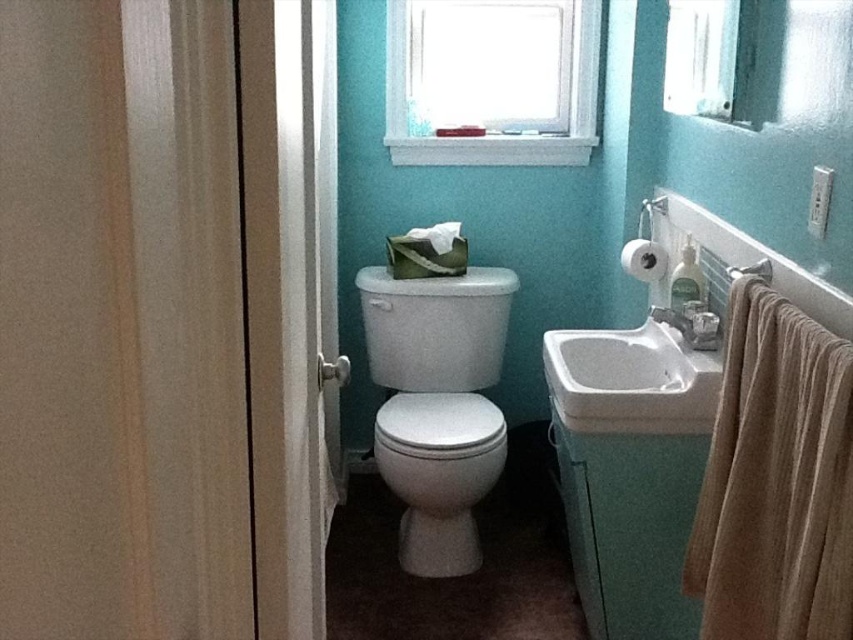
Question: Which point is closer to the camera taking this photo?

Choices:
 (A) (764, 268)
 (B) (666, 426)
 (C) (448, 296)

Answer: (A)

Question: Is white glossy toilet bowl at center below clear glass window at upper right?

Choices:
 (A) yes
 (B) no

Answer: (A)

Question: Is white plastic window at upper center further to camera compared to white glossy toilet bowl at center?

Choices:
 (A) no
 (B) yes

Answer: (B)

Question: Can you confirm if white glossy sink at center is positioned above metallic silver towel bar at right?

Choices:
 (A) yes
 (B) no

Answer: (B)

Question: Which object is the closest to the white plastic window at upper center?

Choices:
 (A) clear glass window at upper right
 (B) white glossy toilet at center
 (C) white glossy toilet bowl at center
 (D) metallic silver towel bar at right

Answer: (A)

Question: Which point is farther to the camera?

Choices:
 (A) pos(679,349)
 (B) pos(497,451)
 (C) pos(660,248)
 (D) pos(764,260)

Answer: (B)